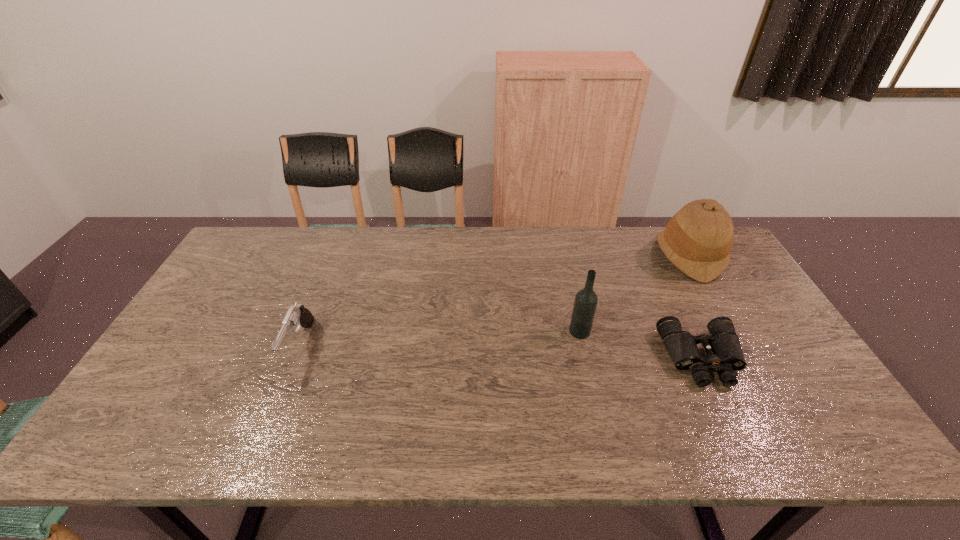
The image size is (960, 540). I want to click on vacant space located 0.130m through the eyepieces of the shortest object, so click(x=739, y=437).

The height and width of the screenshot is (540, 960). Identify the location of object present at the far edge. (698, 239).

Find the location of a particular element. The image size is (960, 540). hat situated at the right edge is located at coordinates (698, 239).

Where is `binoculars positioned at the right edge`? This screenshot has height=540, width=960. binoculars positioned at the right edge is located at coordinates (724, 353).

Image resolution: width=960 pixels, height=540 pixels. I want to click on object located in the far right corner section of the desktop, so tap(698, 239).

The height and width of the screenshot is (540, 960). Identify the location of vacant space at the far edge of the desktop. (422, 256).

The width and height of the screenshot is (960, 540). What are the coordinates of `blank space at the near edge of the desktop` in the screenshot? It's located at (365, 430).

Image resolution: width=960 pixels, height=540 pixels. Find the location of `free spot at the left edge of the desktop`. free spot at the left edge of the desktop is located at coordinates (211, 323).

Locate an element on the screen. The image size is (960, 540). vacant region at the far left corner is located at coordinates coord(257,251).

In the image, there is a desktop. Identify the location of vacant space at the near right corner. Image resolution: width=960 pixels, height=540 pixels. (845, 443).